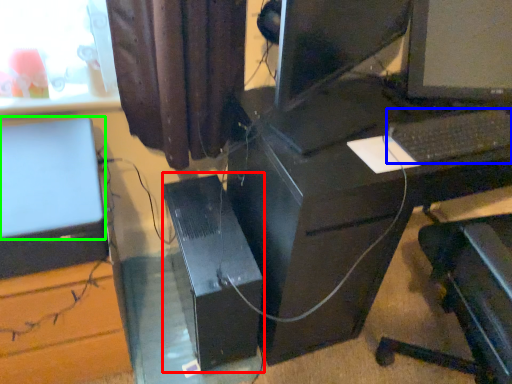
Question: Which object is positioned closest to computer tower (highlighted by a red box)? Select from computer keyboard (highlighted by a blue box) and computer monitor (highlighted by a green box).

Choices:
 (A) computer keyboard
 (B) computer monitor

Answer: (B)